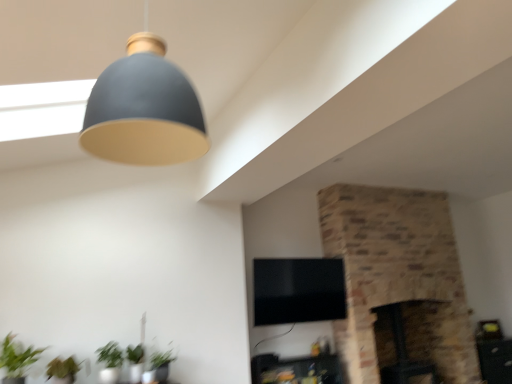
Question: Does wooden side table at lower right, placed as the 2th furniture when sorted from left to right, contain dark brown stone fireplace at center-right, acting as the 2th fireplace starting from the right?

Choices:
 (A) no
 (B) yes

Answer: (A)

Question: Is wooden side table at lower right, the 1th furniture when ordered from back to front, at the right side of dark brown stone fireplace at center-right, acting as the 2th fireplace starting from the right?

Choices:
 (A) no
 (B) yes

Answer: (B)

Question: Can you confirm if wooden side table at lower right, the second furniture in the front-to-back sequence, is smaller than dark brown stone fireplace at center-right, the 1th fireplace when ordered from left to right?

Choices:
 (A) no
 (B) yes

Answer: (A)

Question: Can you see wooden side table at lower right, the second furniture in the front-to-back sequence, touching dark brown stone fireplace at center-right, the 1th fireplace when ordered from left to right?

Choices:
 (A) no
 (B) yes

Answer: (A)

Question: Can you confirm if wooden side table at lower right, the first furniture viewed from the right, is bigger than dark brown stone fireplace at center-right, the 1th fireplace when ordered from left to right?

Choices:
 (A) no
 (B) yes

Answer: (B)

Question: In terms of height, does matte black tv stand at lower center, which is the second furniture in right-to-left order, look taller or shorter compared to green matte plant at lower left?

Choices:
 (A) short
 (B) tall

Answer: (A)

Question: Is point (271, 354) closer or farther from the camera than point (31, 362)?

Choices:
 (A) closer
 (B) farther

Answer: (B)

Question: Relative to green matte plant at lower left, is matte black tv stand at lower center, the first furniture viewed from the front, in front or behind?

Choices:
 (A) front
 (B) behind

Answer: (B)

Question: Looking at the image, does matte black tv stand at lower center, which appears as the first furniture when viewed from the left, seem bigger or smaller compared to green matte plant at lower left?

Choices:
 (A) big
 (B) small

Answer: (A)

Question: In terms of width, does green matte plant at lower left, which ranks as the first plant in right-to-left order, look wider or thinner when compared to matte black tv stand at lower center, which appears as the first furniture when viewed from the left?

Choices:
 (A) wide
 (B) thin

Answer: (B)

Question: From the image's perspective, is green matte plant at lower left, which ranks as the first plant in right-to-left order, positioned above or below matte black tv stand at lower center, the first furniture viewed from the front?

Choices:
 (A) above
 (B) below

Answer: (A)

Question: Considering the positions of green matte plant at lower left, arranged as the 2th plant when viewed from the left, and matte black tv stand at lower center, the first furniture viewed from the front, in the image, is green matte plant at lower left, arranged as the 2th plant when viewed from the left, taller or shorter than matte black tv stand at lower center, the first furniture viewed from the front,?

Choices:
 (A) short
 (B) tall

Answer: (A)

Question: From a real-world perspective, is green matte plant at lower left, arranged as the 2th plant when viewed from the left, physically located above or below matte black tv stand at lower center, which appears as the first furniture when viewed from the left?

Choices:
 (A) above
 (B) below

Answer: (A)

Question: From a real-world perspective, relative to brick fireplace at center, acting as the 1th fireplace starting from the right, is green matte plant at lower left vertically above or below?

Choices:
 (A) below
 (B) above

Answer: (A)

Question: Is green matte plant at lower left to the left or to the right of brick fireplace at center, which is the second fireplace from left to right, in the image?

Choices:
 (A) left
 (B) right

Answer: (A)